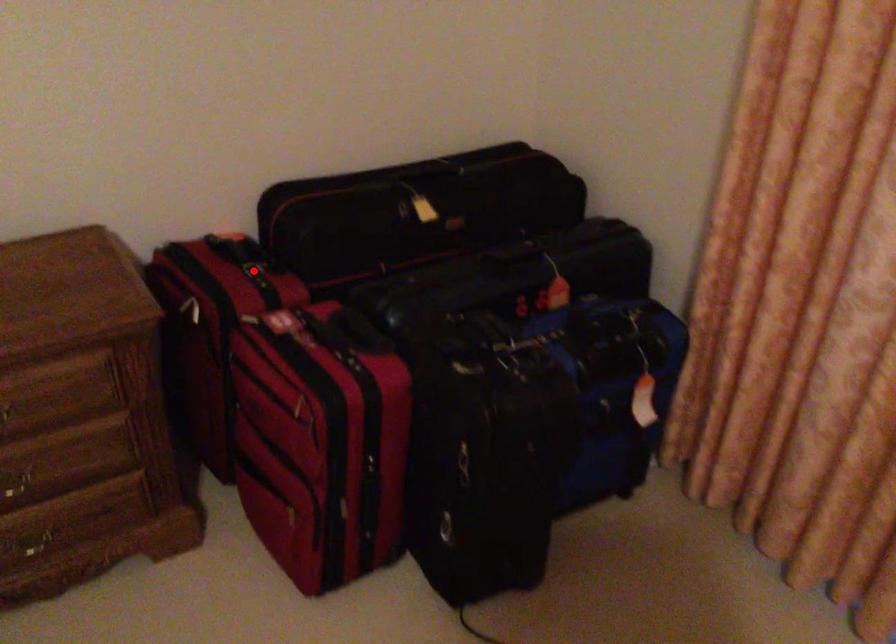
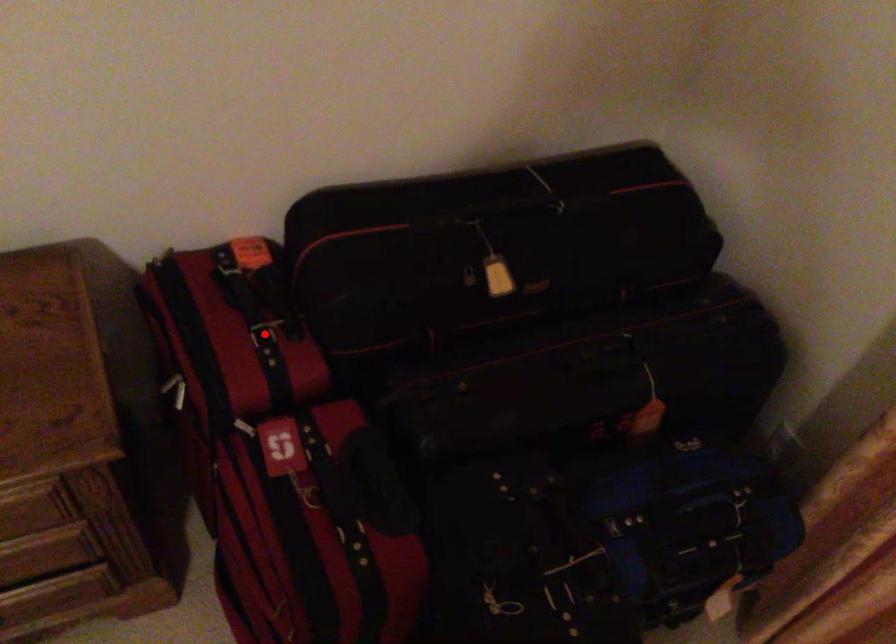
I am providing you with two images of the same scene from different viewpoints. A red point is marked on the first image and another point is marked on the second image. Are the points marked in image1 and image2 representing the same 3D position?

Yes